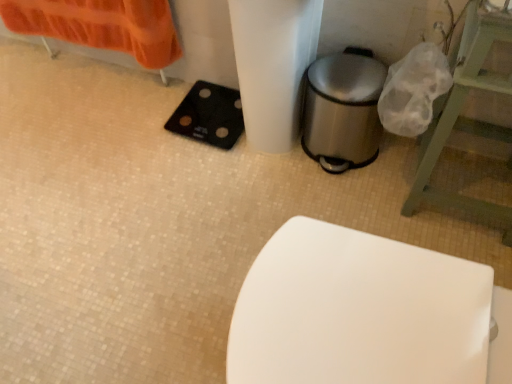
Question: Does green wooden stool at right have a lesser height compared to polished stainless steel trash can at lower right?

Choices:
 (A) yes
 (B) no

Answer: (B)

Question: Considering the relative positions of green wooden stool at right and polished stainless steel trash can at lower right in the image provided, is green wooden stool at right in front of polished stainless steel trash can at lower right?

Choices:
 (A) no
 (B) yes

Answer: (B)

Question: Is green wooden stool at right not close to polished stainless steel trash can at lower right?

Choices:
 (A) no
 (B) yes

Answer: (A)

Question: Does green wooden stool at right have a smaller size compared to polished stainless steel trash can at lower right?

Choices:
 (A) no
 (B) yes

Answer: (A)

Question: From the image's perspective, is green wooden stool at right located beneath polished stainless steel trash can at lower right?

Choices:
 (A) yes
 (B) no

Answer: (A)

Question: Is green wooden stool at right wider than polished stainless steel trash can at lower right?

Choices:
 (A) yes
 (B) no

Answer: (A)

Question: From the image's perspective, is black rubber scale at lower left on top of polished stainless steel trash can at lower right?

Choices:
 (A) yes
 (B) no

Answer: (A)

Question: Does black rubber scale at lower left have a larger size compared to polished stainless steel trash can at lower right?

Choices:
 (A) yes
 (B) no

Answer: (B)

Question: From the image's perspective, would you say black rubber scale at lower left is shown under polished stainless steel trash can at lower right?

Choices:
 (A) no
 (B) yes

Answer: (A)

Question: Can you confirm if black rubber scale at lower left is wider than polished stainless steel trash can at lower right?

Choices:
 (A) yes
 (B) no

Answer: (A)

Question: Is black rubber scale at lower left not close to polished stainless steel trash can at lower right?

Choices:
 (A) yes
 (B) no

Answer: (B)

Question: From a real-world perspective, is black rubber scale at lower left located higher than polished stainless steel trash can at lower right?

Choices:
 (A) no
 (B) yes

Answer: (A)

Question: Is green wooden stool at right positioned beyond the bounds of black rubber scale at lower left?

Choices:
 (A) yes
 (B) no

Answer: (A)